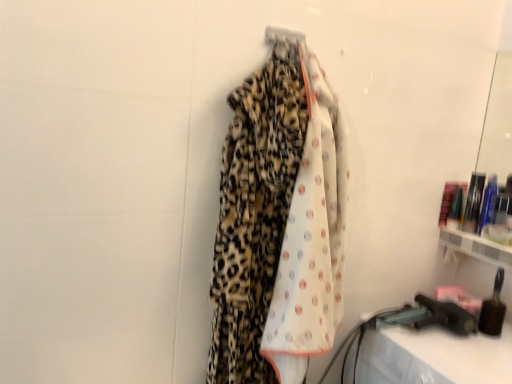
Question: Is metallic silver hanger at upper center spatially inside translucent plastic bottles at right, the first toiletry from the top, or outside of it?

Choices:
 (A) outside
 (B) inside

Answer: (A)

Question: Is metallic silver hanger at upper center taller or shorter than translucent plastic bottles at right, the 1th toiletry viewed from the back?

Choices:
 (A) tall
 (B) short

Answer: (B)

Question: Which of these objects is positioned closest to the brown bristle brush at lower right, the second toiletry when ordered from back to front?

Choices:
 (A) translucent plastic bottles at right, the second toiletry positioned from the bottom
 (B) leopard print fabric at center
 (C) metallic silver hanger at upper center

Answer: (A)

Question: Based on their relative distances, which object is farther from the leopard print fabric at center?

Choices:
 (A) brown bristle brush at lower right, placed as the second toiletry when sorted from top to bottom
 (B) translucent plastic bottles at right, the 1th toiletry viewed from the back
 (C) metallic silver hanger at upper center

Answer: (B)